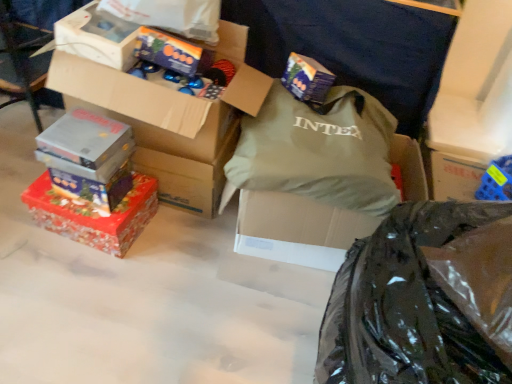
Identify the location of vacant space situated on the left part of matte green pillow at center, acting as the 7th box starting from the left. This screenshot has height=384, width=512. (168, 262).